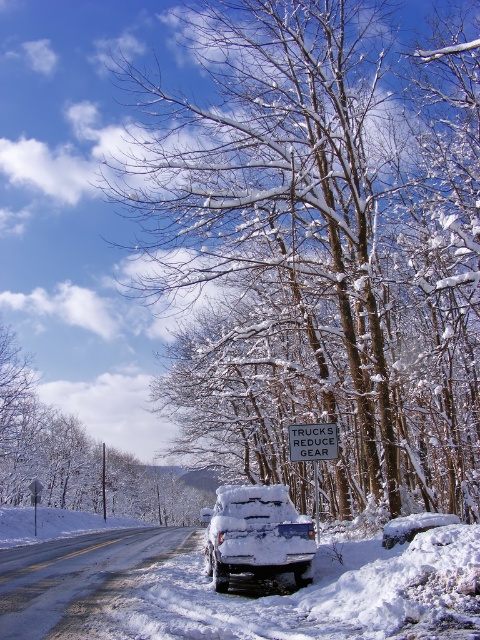
Question: Can you confirm if white fluffy snow at center is wider than white plastic sign at upper center?

Choices:
 (A) no
 (B) yes

Answer: (B)

Question: Among these objects, which one is nearest to the camera?

Choices:
 (A) snow-covered branches at upper center
 (B) snow-covered suv at center
 (C) white plastic sign at upper center
 (D) white fluffy snow at center

Answer: (D)

Question: Which point is farther to the camera?

Choices:
 (A) metallic rectangular sign at center
 (B) snow-covered branches at upper center
 (C) white plastic sign at upper center
 (D) white fluffy snow at center

Answer: (C)

Question: Which of the following is the closest to the observer?

Choices:
 (A) (36, 499)
 (B) (192, 605)
 (C) (260, 561)

Answer: (B)

Question: Observing the image, what is the correct spatial positioning of snow-covered branches at upper center in reference to metallic rectangular sign at center?

Choices:
 (A) below
 (B) above

Answer: (B)

Question: Can you confirm if snow-covered branches at upper center is thinner than metallic rectangular sign at center?

Choices:
 (A) no
 (B) yes

Answer: (A)